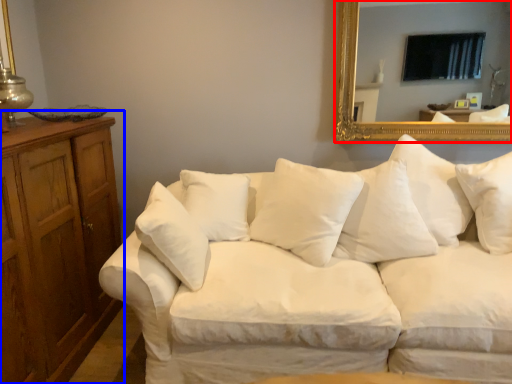
Question: Which object appears closest to the camera in this image, mirror (highlighted by a red box) or dresser (highlighted by a blue box)?

Choices:
 (A) mirror
 (B) dresser

Answer: (B)